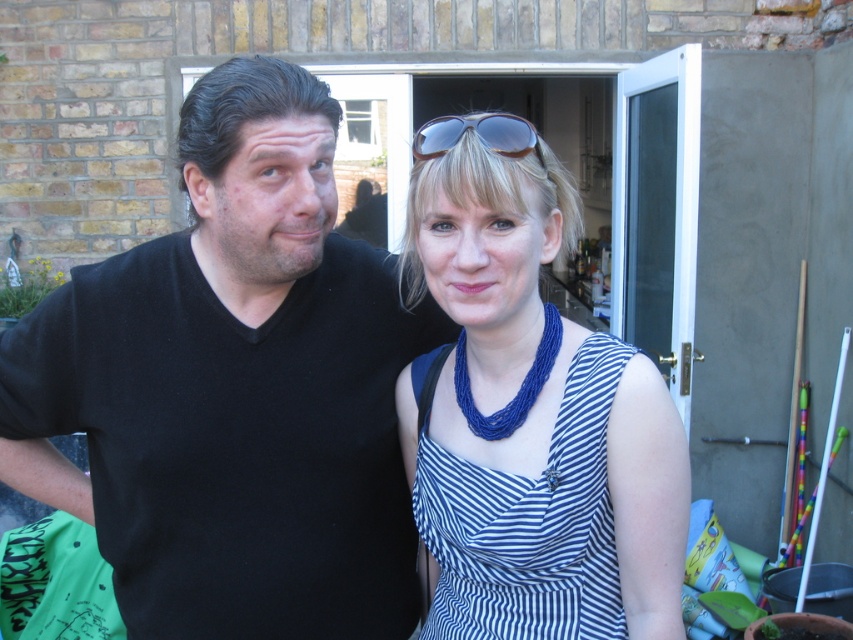
Question: Does blue woven necklace at center have a lesser width compared to blue striped dress at center?

Choices:
 (A) no
 (B) yes

Answer: (A)

Question: Which object appears farthest from the camera in this image?

Choices:
 (A) black matte shirt at left
 (B) blue woven necklace at center
 (C) blue striped dress at center
 (D) sunglasses at upper center

Answer: (A)

Question: Which object is the farthest from the blue woven necklace at center?

Choices:
 (A) sunglasses at upper center
 (B) blue striped dress at center

Answer: (A)

Question: Among these points, which one is farthest from the camera?

Choices:
 (A) (608, 608)
 (B) (561, 252)

Answer: (B)

Question: Does blue woven necklace at center have a greater width compared to blue striped dress at center?

Choices:
 (A) no
 (B) yes

Answer: (B)

Question: Is blue striped dress at center wider than sunglasses at upper center?

Choices:
 (A) yes
 (B) no

Answer: (A)